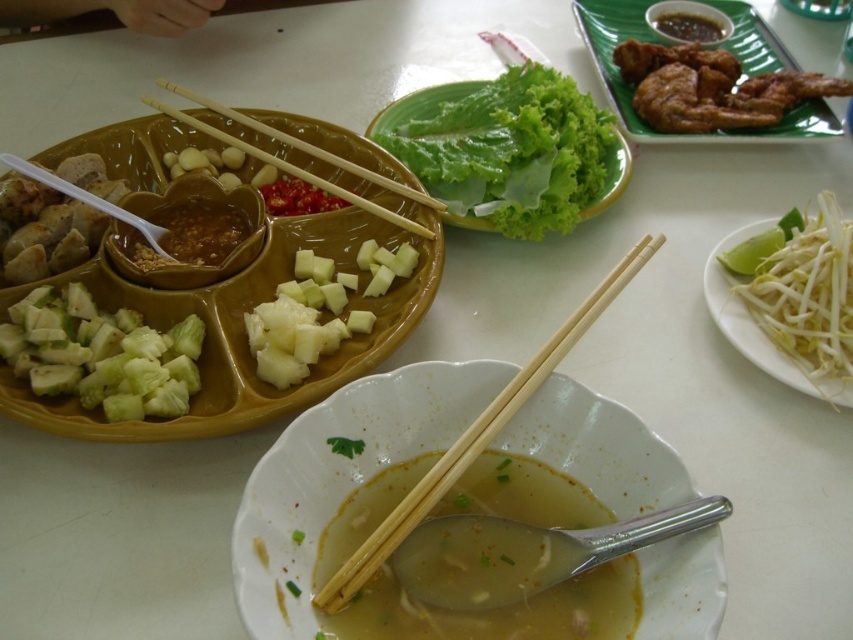
Question: Which of the following is the closest to the observer?

Choices:
 (A) green/crisp cucumber at left
 (B) matte brown sauce at center
 (C) brown glossy sauce at upper center
 (D) green leafy lettuce at center

Answer: (A)

Question: Which point appears closest to the camera in this image?

Choices:
 (A) (361, 172)
 (B) (460, 465)
 (C) (378, 305)
 (D) (329, 492)

Answer: (B)

Question: Which point is closer to the camera?

Choices:
 (A) (270, 547)
 (B) (42, 292)
 (C) (410, 196)

Answer: (A)

Question: Is translucent yellow broth at center bigger than green/crisp cucumber at left?

Choices:
 (A) yes
 (B) no

Answer: (A)

Question: Is golden fried chicken at upper right below yellowish matte pineapple at center?

Choices:
 (A) no
 (B) yes

Answer: (A)

Question: Is matte brown sauce at center to the left of wooden chopsticks at upper center from the viewer's perspective?

Choices:
 (A) no
 (B) yes

Answer: (B)